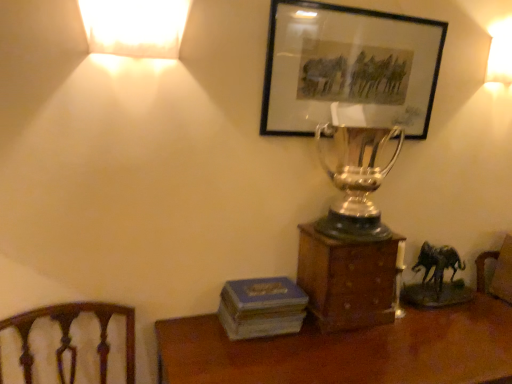
Locate an element on the screen. The width and height of the screenshot is (512, 384). blank space situated above matte black picture frame at upper center (from a real-world perspective) is located at coordinates (358, 16).